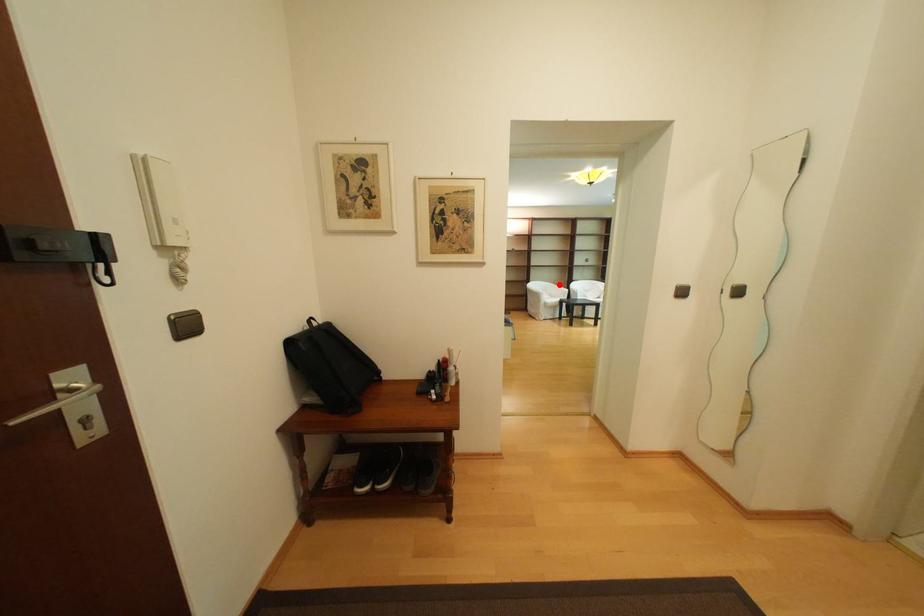
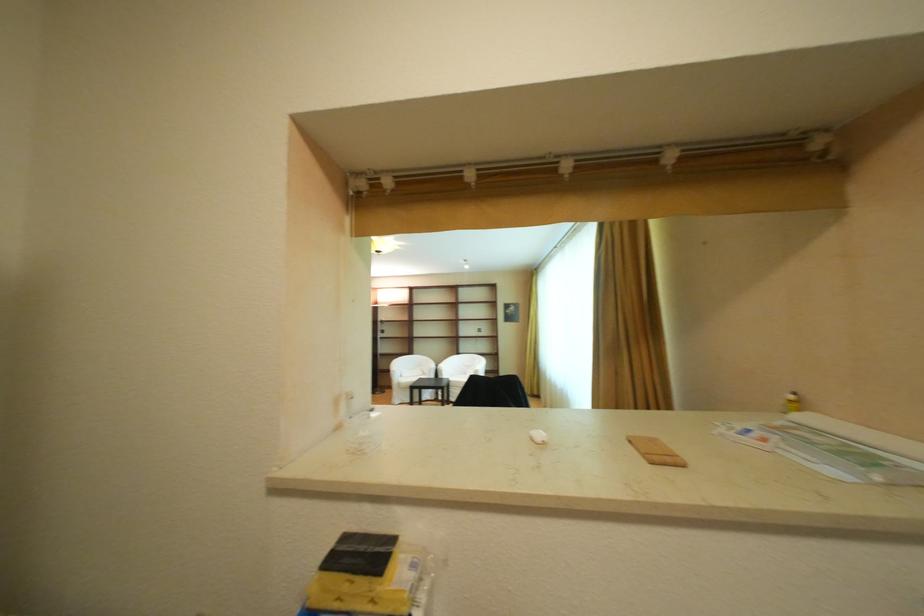
Question: I am providing you with two images of the same scene from different viewpoints. Image1 has a red point marked. In image2, the corresponding 3D location appears at what relative position? Reply with the corresponding letter.

Choices:
 (A) Closer
 (B) Farther

Answer: (B)